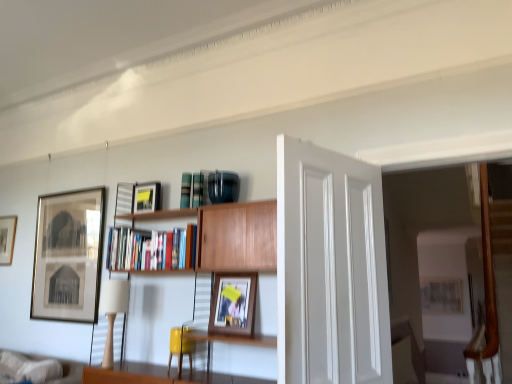
Question: Is matte black picture frame at upper center, the second picture frame from the front, in front of wooden bookcase at center?

Choices:
 (A) no
 (B) yes

Answer: (A)

Question: Considering the relative sizes of matte black picture frame at upper center, which is counted as the 2th picture frame, starting from the right, and wooden bookcase at center in the image provided, is matte black picture frame at upper center, which is counted as the 2th picture frame, starting from the right, thinner than wooden bookcase at center?

Choices:
 (A) no
 (B) yes

Answer: (B)

Question: Considering the relative positions of matte black picture frame at upper center, which is counted as the 2th picture frame, starting from the right, and wooden bookcase at center in the image provided, is matte black picture frame at upper center, which is counted as the 2th picture frame, starting from the right, to the left of wooden bookcase at center from the viewer's perspective?

Choices:
 (A) no
 (B) yes

Answer: (B)

Question: From the image's perspective, is matte black picture frame at upper center, marked as the third picture frame in a left-to-right arrangement, on top of wooden bookcase at center?

Choices:
 (A) no
 (B) yes

Answer: (B)

Question: Is matte black picture frame at upper center, which is counted as the 2th picture frame, starting from the right, oriented away from wooden bookcase at center?

Choices:
 (A) yes
 (B) no

Answer: (B)

Question: Considering the relative sizes of matte black picture frame at upper center, marked as the third picture frame in a left-to-right arrangement, and wooden bookcase at center in the image provided, is matte black picture frame at upper center, marked as the third picture frame in a left-to-right arrangement, wider than wooden bookcase at center?

Choices:
 (A) yes
 (B) no

Answer: (B)

Question: Is matte black picture frame at left, marked as the 3th picture frame in a front-to-back arrangement, positioned beyond the bounds of matte black picture frame at left, which appears as the first picture frame when viewed from the back?

Choices:
 (A) no
 (B) yes

Answer: (B)

Question: Does matte black picture frame at left, marked as the second picture frame in a left-to-right arrangement, come behind matte black picture frame at left, marked as the first picture frame in a left-to-right arrangement?

Choices:
 (A) yes
 (B) no

Answer: (B)

Question: Is matte black picture frame at left, which appears as the 4th picture frame when viewed from the right, at the back of matte black picture frame at left, the 2th picture frame positioned from the back?

Choices:
 (A) yes
 (B) no

Answer: (B)

Question: Would you say matte black picture frame at left, the third picture frame from the right, contains matte black picture frame at left, which appears as the first picture frame when viewed from the back?

Choices:
 (A) yes
 (B) no

Answer: (B)

Question: Does matte black picture frame at left, marked as the 3th picture frame in a front-to-back arrangement, turn towards matte black picture frame at left, which appears as the 4th picture frame when viewed from the right?

Choices:
 (A) yes
 (B) no

Answer: (B)

Question: Does matte black picture frame at left, marked as the second picture frame in a left-to-right arrangement, have a greater height compared to matte black picture frame at left, marked as the first picture frame in a left-to-right arrangement?

Choices:
 (A) no
 (B) yes

Answer: (B)

Question: Considering the relative positions of beige fabric lampshade at left and wooden framed photo at center, the 4th picture frame in the left-to-right sequence, in the image provided, is beige fabric lampshade at left to the left of wooden framed photo at center, the 4th picture frame in the left-to-right sequence, from the viewer's perspective?

Choices:
 (A) no
 (B) yes

Answer: (B)